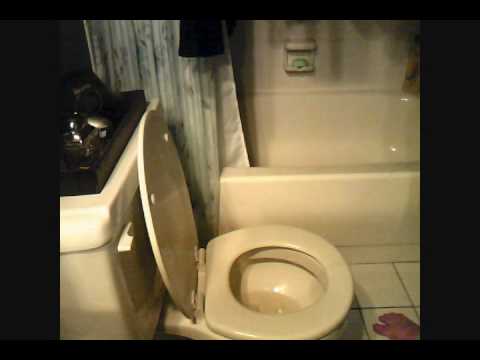
Find the location of a particular element. This screenshot has height=360, width=480. toilet cover is located at coordinates (164, 217).